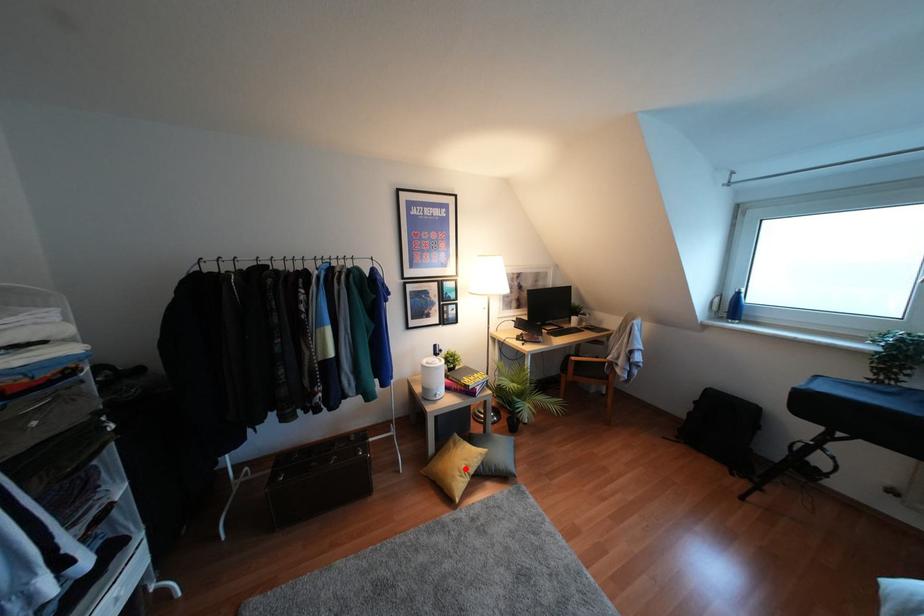
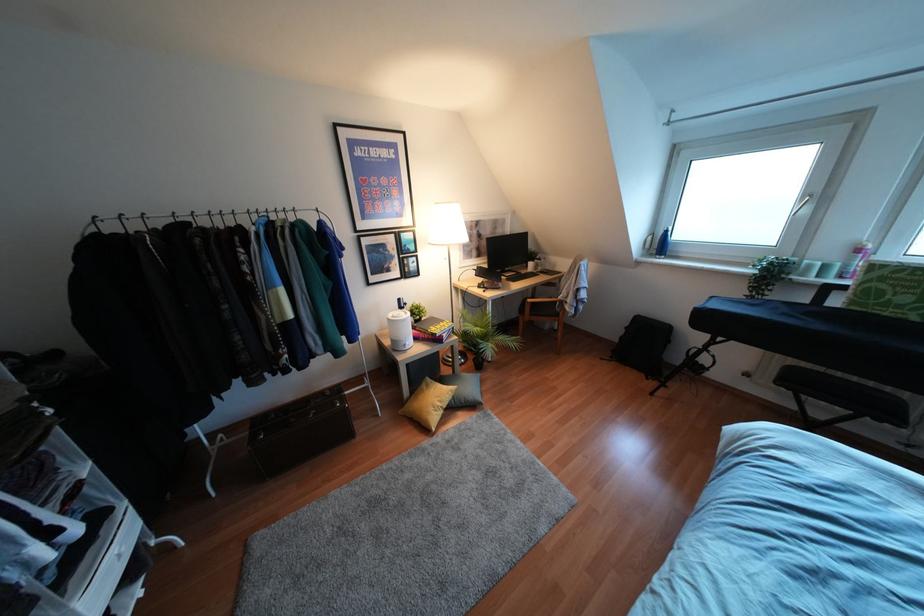
Where in the second image is the point corresponding to the highlighted location from the first image?

(439, 403)